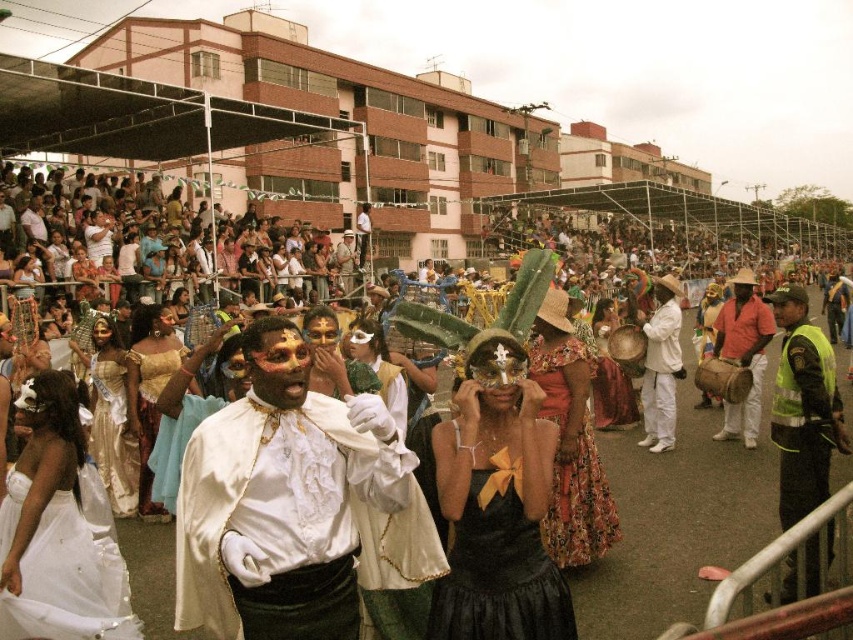
Which is below, orange cotton shirt at center or matte gold mask at center?

Positioned lower is orange cotton shirt at center.

Who is shorter, orange cotton shirt at center or matte gold mask at center?

matte gold mask at center is shorter.

Is point (740, 362) farther from viewer compared to point (344, 284)?

No.

Where is `orange cotton shirt at center`? orange cotton shirt at center is located at coordinates (743, 355).

Does point (200, 509) come farther from viewer compared to point (549, 369)?

No, it is not.

Can you confirm if white satin cape at center is smaller than floral fabric dress at center?

Incorrect, white satin cape at center is not smaller in size than floral fabric dress at center.

Between point (193, 460) and point (572, 563), which one is positioned in front?

Positioned in front is point (193, 460).

Find the location of `white satin cape at center`. white satin cape at center is located at coordinates (287, 500).

Can you confirm if floral fabric dress at center is positioned above orange cotton shirt at center?

Actually, floral fabric dress at center is below orange cotton shirt at center.

Image resolution: width=853 pixels, height=640 pixels. What do you see at coordinates (579, 506) in the screenshot?
I see `floral fabric dress at center` at bounding box center [579, 506].

I want to click on floral fabric dress at center, so click(x=579, y=506).